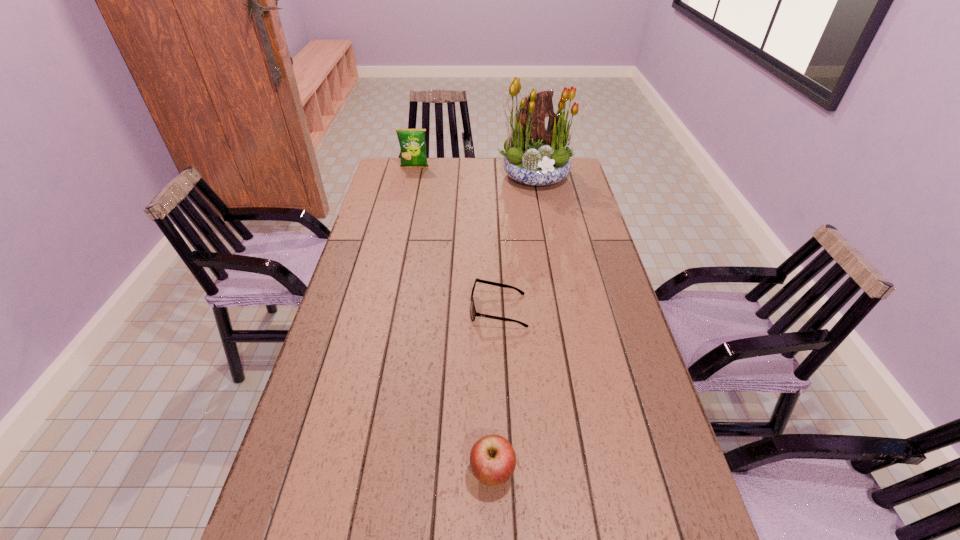
Where is `vacant area situated 0.270m on the front-facing side of the sunglasses`? This screenshot has height=540, width=960. vacant area situated 0.270m on the front-facing side of the sunglasses is located at coordinates (377, 309).

Find the location of a particular element. Image resolution: width=960 pixels, height=540 pixels. vacant area situated on the front-facing side of the sunglasses is located at coordinates (401, 309).

Identify the location of vacant position located on the front-facing side of the sunglasses. (405, 309).

Where is `flower arrangement situated at the far edge`? This screenshot has height=540, width=960. flower arrangement situated at the far edge is located at coordinates (535, 155).

Where is `crisp (potato chip) at the far edge`? crisp (potato chip) at the far edge is located at coordinates (412, 142).

Locate an element on the screen. Image resolution: width=960 pixels, height=540 pixels. object that is at the left edge is located at coordinates (412, 142).

The height and width of the screenshot is (540, 960). I want to click on object at the right edge, so click(535, 155).

The width and height of the screenshot is (960, 540). I want to click on object positioned at the far left corner, so click(x=412, y=142).

Where is `object at the far right corner`? object at the far right corner is located at coordinates (535, 155).

Locate an element on the screen. vacant space at the far edge of the desktop is located at coordinates (496, 173).